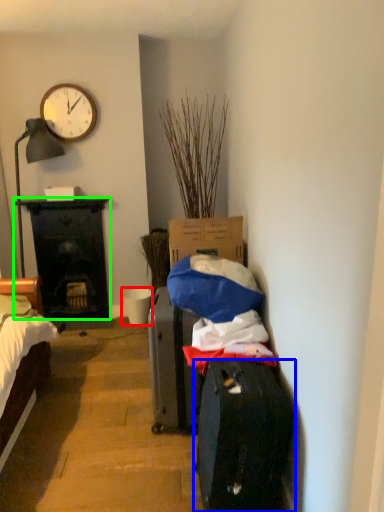
Question: Which object is positioned farthest from bucket (highlighted by a red box)? Select from luggage and bags (highlighted by a blue box) and desk (highlighted by a green box).

Choices:
 (A) luggage and bags
 (B) desk

Answer: (A)